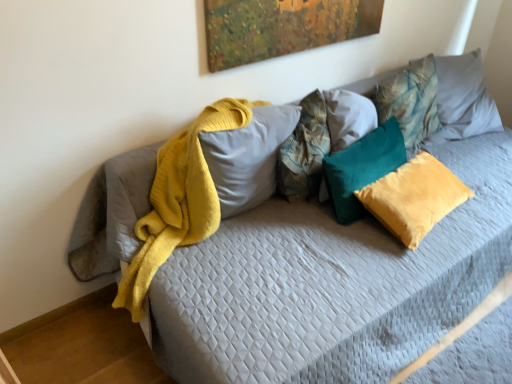
Question: Looking at the image, does teal velvet pillow at upper right, positioned as the 1th pillow in right-to-left order, seem bigger or smaller compared to teal velvet pillow at center, acting as the 3th pillow starting from the right?

Choices:
 (A) small
 (B) big

Answer: (B)

Question: In the image, is teal velvet pillow at upper right, marked as the 5th pillow in a left-to-right arrangement, on the left side or the right side of teal velvet pillow at center, acting as the 3th pillow starting from the right?

Choices:
 (A) right
 (B) left

Answer: (A)

Question: Considering the real-world distances, which object is farthest from the teal velvet pillow at center, acting as the 3th pillow starting from the right?

Choices:
 (A) soft yellow fabric pillow at center, which ranks as the fifth pillow in right-to-left order
 (B) teal velvet pillow at center, which is the fourth pillow in left-to-right order
 (C) teal velvet pillow at upper right, marked as the 5th pillow in a left-to-right arrangement
 (D) textured teal pillow at center, which is counted as the fourth pillow, starting from the right

Answer: (A)

Question: Which of these objects is positioned closest to the textured teal pillow at center, which is counted as the fourth pillow, starting from the right?

Choices:
 (A) teal velvet pillow at center, which is the 2th pillow in right-to-left order
 (B) teal velvet pillow at upper right, marked as the 5th pillow in a left-to-right arrangement
 (C) teal velvet pillow at center, the third pillow positioned from the left
 (D) soft yellow fabric pillow at center, which ranks as the fifth pillow in right-to-left order

Answer: (D)